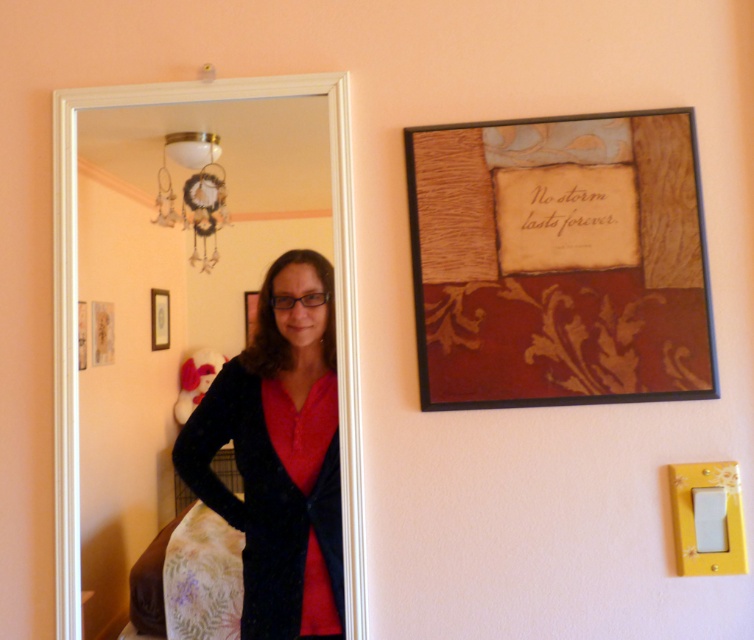
Question: Which point is farther to the camera?

Choices:
 (A) matte black picture frame at center
 (B) wooden picture frame at center

Answer: (A)

Question: Which object appears farthest from the camera in this image?

Choices:
 (A) matte black picture frame at center
 (B) velvet black cardigan at left
 (C) wooden plaque at upper right

Answer: (A)

Question: Which point is closer to the camera?

Choices:
 (A) (581, 259)
 (B) (250, 342)
 (C) (326, 316)
 (D) (152, 307)

Answer: (A)

Question: Is velvet black cardigan at left further to camera compared to wooden picture frame at center?

Choices:
 (A) no
 (B) yes

Answer: (A)

Question: Is wooden plaque at upper right in front of velvet black cardigan at left?

Choices:
 (A) yes
 (B) no

Answer: (A)

Question: Can you confirm if wooden plaque at upper right is positioned below velvet black cardigan at left?

Choices:
 (A) no
 (B) yes

Answer: (A)